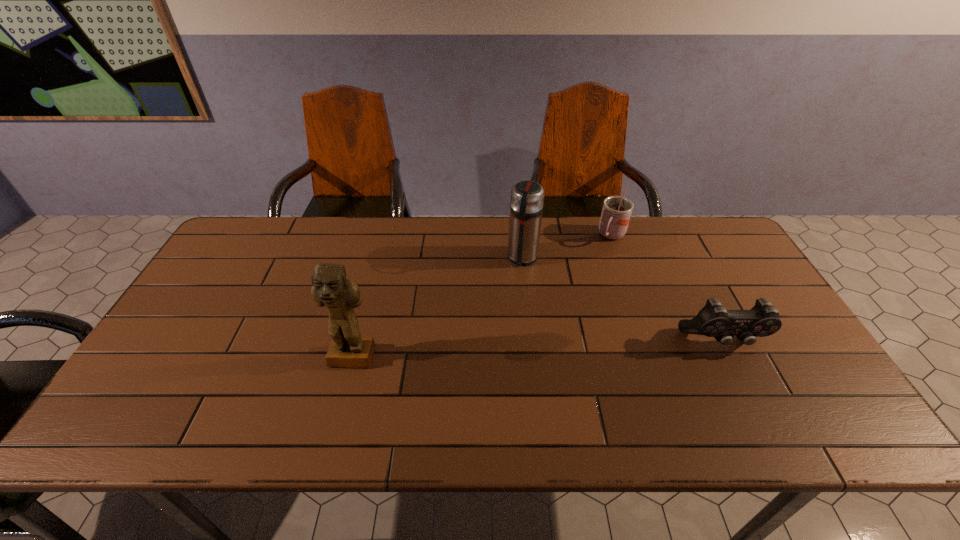
Find the location of `blank space located on the side with the handle of the second object from right to left`. blank space located on the side with the handle of the second object from right to left is located at coordinates (579, 287).

Identify the location of free space located with a handle on the side of the second object from left to right. (504, 317).

The image size is (960, 540). I want to click on vacant space positioned with a handle on the side of the second object from left to right, so click(x=485, y=376).

Locate an element on the screen. vacant area situated with a handle on the side of the second object from left to right is located at coordinates (495, 345).

This screenshot has height=540, width=960. Identify the location of cup located at the far edge. (616, 212).

Locate an element on the screen. thermos bottle at the far edge is located at coordinates (526, 202).

Where is `object located in the near edge section of the desktop`? object located in the near edge section of the desktop is located at coordinates (330, 287).

The height and width of the screenshot is (540, 960). Identify the location of object located at the right edge. (713, 320).

Locate an element on the screen. The image size is (960, 540). vacant region at the far edge of the desktop is located at coordinates (417, 220).

You are a GUI agent. You are given a task and a screenshot of the screen. Output one action in this format:
    pyautogui.click(x=<x>, y=<y>)
    Task: Click on the vacant region at the near edge of the desktop
    
    Given the screenshot: What is the action you would take?
    pyautogui.click(x=338, y=377)